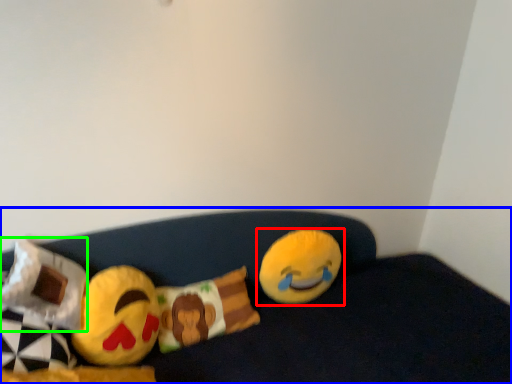
Question: Which object is the farthest from toy (highlighted by a red box)? Choose among these: furniture (highlighted by a blue box) or pillow (highlighted by a green box).

Choices:
 (A) furniture
 (B) pillow

Answer: (B)